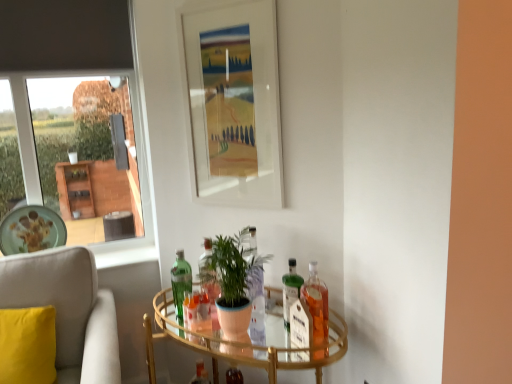
Question: Considering the relative sizes of matte ceramic plate at left and translucent glass bottle at right, the fourth bottle from the back, in the image provided, is matte ceramic plate at left wider than translucent glass bottle at right, the fourth bottle from the back,?

Choices:
 (A) no
 (B) yes

Answer: (B)

Question: From the image's perspective, would you say matte ceramic plate at left is positioned over translucent glass bottle at right, the 1th bottle in the right-to-left sequence?

Choices:
 (A) no
 (B) yes

Answer: (B)

Question: From a real-world perspective, is matte ceramic plate at left physically above translucent glass bottle at right, the first bottle in the front-to-back sequence?

Choices:
 (A) yes
 (B) no

Answer: (A)

Question: From a real-world perspective, is matte ceramic plate at left under translucent glass bottle at right, which is the fourth bottle from left to right?

Choices:
 (A) no
 (B) yes

Answer: (A)

Question: Considering the relative sizes of matte ceramic plate at left and translucent glass bottle at right, which is the fourth bottle from left to right, in the image provided, is matte ceramic plate at left shorter than translucent glass bottle at right, which is the fourth bottle from left to right,?

Choices:
 (A) yes
 (B) no

Answer: (B)

Question: From the image's perspective, is soft beige fabric chair at left above or below green matte plant at center?

Choices:
 (A) above
 (B) below

Answer: (B)

Question: In the image, is soft beige fabric chair at left on the left side or the right side of green matte plant at center?

Choices:
 (A) left
 (B) right

Answer: (A)

Question: In terms of width, does soft beige fabric chair at left look wider or thinner when compared to green matte plant at center?

Choices:
 (A) thin
 (B) wide

Answer: (B)

Question: Is soft beige fabric chair at left taller or shorter than green matte plant at center?

Choices:
 (A) tall
 (B) short

Answer: (A)

Question: In terms of size, does matte ceramic plate at left appear bigger or smaller than translucent glass bottle at right, the first bottle in the front-to-back sequence?

Choices:
 (A) small
 (B) big

Answer: (B)

Question: From the image's perspective, relative to translucent glass bottle at right, the first bottle in the front-to-back sequence, is matte ceramic plate at left above or below?

Choices:
 (A) below
 (B) above

Answer: (B)

Question: Considering the relative positions of matte ceramic plate at left and translucent glass bottle at right, which is the fourth bottle from left to right, in the image provided, is matte ceramic plate at left to the left or to the right of translucent glass bottle at right, which is the fourth bottle from left to right,?

Choices:
 (A) right
 (B) left

Answer: (B)

Question: Is matte ceramic plate at left taller or shorter than translucent glass bottle at right, which is the fourth bottle from left to right?

Choices:
 (A) short
 (B) tall

Answer: (B)

Question: Is clear glass table at center in front of or behind translucent glass bottle at center, which is the first bottle from back to front, in the image?

Choices:
 (A) behind
 (B) front

Answer: (B)

Question: Is clear glass table at center situated inside translucent glass bottle at center, which is the first bottle from back to front, or outside?

Choices:
 (A) inside
 (B) outside

Answer: (B)